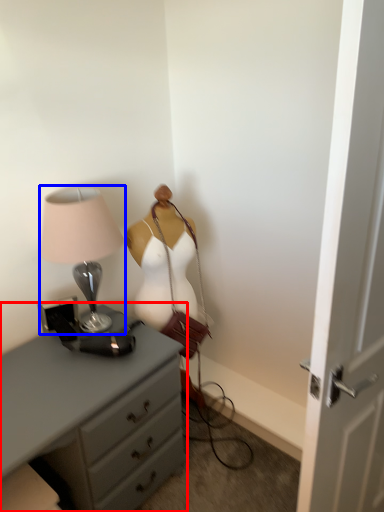
Question: Which point is further to the camera, chest of drawers (highlighted by a red box) or lamp (highlighted by a blue box)?

Choices:
 (A) chest of drawers
 (B) lamp

Answer: (B)